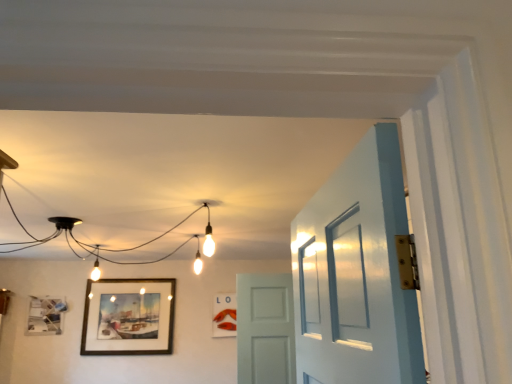
Question: Visually, is wooden framed painting at lower left, acting as the second picture frame starting from the left, positioned to the left or to the right of white matte door at center?

Choices:
 (A) right
 (B) left

Answer: (B)

Question: Considering their positions, is wooden framed painting at lower left, acting as the second picture frame starting from the left, located in front of or behind white matte door at center?

Choices:
 (A) behind
 (B) front

Answer: (A)

Question: Estimate the real-world distances between objects in this image. Which object is farther from the white matte door at center?

Choices:
 (A) matte black picture frame at upper left, placed as the first picture frame when sorted from left to right
 (B) matte wooden picture frame at center, the first picture frame when ordered from right to left
 (C) wooden framed painting at lower left, acting as the second picture frame starting from the left

Answer: (A)

Question: Which object is the closest to the matte black picture frame at upper left, placed as the first picture frame when sorted from left to right?

Choices:
 (A) wooden framed painting at lower left, acting as the second picture frame starting from the left
 (B) matte wooden picture frame at center, the first picture frame when ordered from right to left
 (C) white matte door at center

Answer: (A)